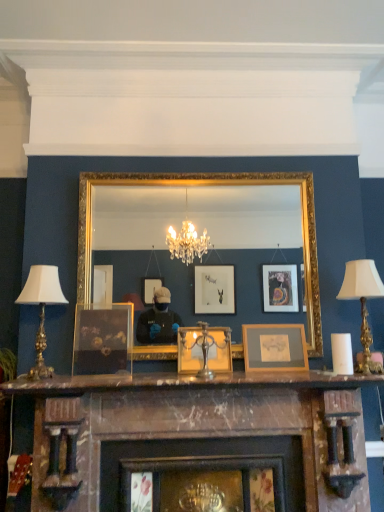
Describe the element at coordinates (199, 440) in the screenshot. I see `marble fireplace at center` at that location.

Identify the location of gold-framed mirror at center. (209, 185).

Where is `wooden picture frame at center, positioned as the first picture frame in right-to-left order`? wooden picture frame at center, positioned as the first picture frame in right-to-left order is located at coordinates (275, 347).

Locate an element on the screen. silver metallic table lamp at left, the 1th table lamp positioned from the left is located at coordinates (41, 309).

The width and height of the screenshot is (384, 512). I want to click on white fabric lampshade at right, the 1th table lamp from the right, so click(362, 296).

Based on their sizes in the image, would you say marble mantel at center is bigger or smaller than marble fireplace at center?

Considering their sizes, marble mantel at center takes up less space than marble fireplace at center.

From the image's perspective, which one is positioned lower, marble mantel at center or marble fireplace at center?

marble fireplace at center.

From a real-world perspective, relative to marble fireplace at center, is marble mantel at center vertically above or below?

Clearly, from a real-world perspective, marble mantel at center is above marble fireplace at center.

Considering the relative sizes of marble mantel at center and marble fireplace at center in the image provided, is marble mantel at center taller than marble fireplace at center?

No.

From the image's perspective, between marble mantel at center and matte glass picture frame at center, acting as the 3th picture frame starting from the right, who is located below?

From the image's view, marble mantel at center is below.

Is marble mantel at center thinner than matte glass picture frame at center, arranged as the first picture frame when viewed from the left?

Incorrect, the width of marble mantel at center is not less than that of matte glass picture frame at center, arranged as the first picture frame when viewed from the left.

Is marble mantel at center to the left of matte glass picture frame at center, acting as the 3th picture frame starting from the right, from the viewer's perspective?

No, marble mantel at center is not to the left of matte glass picture frame at center, acting as the 3th picture frame starting from the right.

Between marble mantel at center and matte glass picture frame at center, arranged as the first picture frame when viewed from the left, which one has smaller size?

With smaller size is matte glass picture frame at center, arranged as the first picture frame when viewed from the left.

Considering the relative sizes of silver metallic table lamp at left, the 2th table lamp when ordered from right to left, and gold-framed mirror at center in the image provided, is silver metallic table lamp at left, the 2th table lamp when ordered from right to left, smaller than gold-framed mirror at center?

Correct, silver metallic table lamp at left, the 2th table lamp when ordered from right to left, occupies less space than gold-framed mirror at center.

From the image's perspective, is silver metallic table lamp at left, the 2th table lamp when ordered from right to left, below gold-framed mirror at center?

Correct, silver metallic table lamp at left, the 2th table lamp when ordered from right to left, appears lower than gold-framed mirror at center in the image.

Who is shorter, silver metallic table lamp at left, the 1th table lamp positioned from the left, or gold-framed mirror at center?

silver metallic table lamp at left, the 1th table lamp positioned from the left.

Where is `the 2nd table lamp positioned below the gold-framed mirror at center (from a real-world perspective)`? the 2nd table lamp positioned below the gold-framed mirror at center (from a real-world perspective) is located at coordinates (41, 309).

Which is less distant, (305,249) or (288,351)?

Positioned in front is point (288,351).

Which of these two, gold-framed mirror at center or wooden picture frame at center, positioned as the first picture frame in right-to-left order, is smaller?

wooden picture frame at center, positioned as the first picture frame in right-to-left order.

Is gold-framed mirror at center next to wooden picture frame at center, positioned as the third picture frame in left-to-right order, and touching it?

There is a gap between gold-framed mirror at center and wooden picture frame at center, positioned as the third picture frame in left-to-right order.

How much distance is there between gold-framed mirror at center and wooden picture frame at center, positioned as the first picture frame in right-to-left order?

gold-framed mirror at center and wooden picture frame at center, positioned as the first picture frame in right-to-left order, are 30.98 centimeters apart.

Is point (376, 283) farther from viewer compared to point (282, 494)?

No, it is not.

From the image's perspective, starting from the marble fireplace at center, which table lamp is the 2nd one above? Please provide its 2D coordinates.

[(362, 296)]

Between white fabric lampshade at right, the 1th table lamp from the right, and marble fireplace at center, which one has smaller width?

white fabric lampshade at right, the 1th table lamp from the right, is thinner.

From a real-world perspective, which is physically above, marble mantel at center or silver metallic table lamp at left, the 2th table lamp when ordered from right to left?

From a 3D spatial view, silver metallic table lamp at left, the 2th table lamp when ordered from right to left, is above.

Is point (263, 372) in front of point (41, 300)?

No, it is not.

Is marble mantel at center further to camera compared to silver metallic table lamp at left, the 2th table lamp when ordered from right to left?

No, marble mantel at center is closer to the viewer.

From the image's perspective, which is below, marble mantel at center or silver metallic table lamp at left, the 1th table lamp positioned from the left?

marble mantel at center, from the image's perspective.

Is gold-framed mirror at center at the back of metallic gold picture frame at center, which is counted as the 2th picture frame, starting from the right?

Yes, gold-framed mirror at center is at the back of metallic gold picture frame at center, which is counted as the 2th picture frame, starting from the right.

The image size is (384, 512). I want to click on mirror behind the metallic gold picture frame at center, which is the second picture frame from left to right, so click(209, 185).

Can you confirm if metallic gold picture frame at center, which is the second picture frame from left to right, is smaller than gold-framed mirror at center?

Correct, metallic gold picture frame at center, which is the second picture frame from left to right, occupies less space than gold-framed mirror at center.

Image resolution: width=384 pixels, height=512 pixels. In order to click on fireplace on the left of marble mantel at center in this screenshot , I will do `click(199, 440)`.

Find the location of a particular element. mantle on the right of matte glass picture frame at center, acting as the 3th picture frame starting from the right is located at coordinates (187, 382).

Which object lies nearer to the anchor point metallic gold picture frame at center, which is the second picture frame from left to right, marble mantel at center or white fabric lampshade at right, the 1th table lamp from the right?

Based on the image, marble mantel at center appears to be nearer to metallic gold picture frame at center, which is the second picture frame from left to right.

In the scene shown: When comparing their distances from matte glass picture frame at center, arranged as the first picture frame when viewed from the left, does marble mantel at center or wooden picture frame at center, positioned as the third picture frame in left-to-right order, seem further?

Based on the image, wooden picture frame at center, positioned as the third picture frame in left-to-right order, appears to be further to matte glass picture frame at center, arranged as the first picture frame when viewed from the left.

From the image, which object appears to be nearer to metallic gold picture frame at center, which is the second picture frame from left to right, white fabric lampshade at right, the 1th table lamp from the right, or silver metallic table lamp at left, the 2th table lamp when ordered from right to left?

The object closer to metallic gold picture frame at center, which is the second picture frame from left to right, is white fabric lampshade at right, the 1th table lamp from the right.

From the image, which object appears to be farther from white fabric lampshade at right, acting as the 2th table lamp starting from the left, gold-framed mirror at center or marble mantel at center?

marble mantel at center lies further to white fabric lampshade at right, acting as the 2th table lamp starting from the left, than the other object.

Looking at the image, which one is located closer to silver metallic table lamp at left, the 1th table lamp positioned from the left, matte glass picture frame at center, arranged as the first picture frame when viewed from the left, or wooden picture frame at center, positioned as the first picture frame in right-to-left order?

matte glass picture frame at center, arranged as the first picture frame when viewed from the left, is positioned closer to the anchor silver metallic table lamp at left, the 1th table lamp positioned from the left.

Which object lies nearer to the anchor point matte glass picture frame at center, arranged as the first picture frame when viewed from the left, metallic gold picture frame at center, which is counted as the 2th picture frame, starting from the right, or white fabric lampshade at right, acting as the 2th table lamp starting from the left?

Among the two, metallic gold picture frame at center, which is counted as the 2th picture frame, starting from the right, is located nearer to matte glass picture frame at center, arranged as the first picture frame when viewed from the left.

Looking at the image, which one is located closer to marble mantel at center, gold-framed mirror at center or metallic gold picture frame at center, which is the second picture frame from left to right?

metallic gold picture frame at center, which is the second picture frame from left to right, is closer to marble mantel at center.

Looking at the image, which one is located further to white fabric lampshade at right, acting as the 2th table lamp starting from the left, matte glass picture frame at center, acting as the 3th picture frame starting from the right, or metallic gold picture frame at center, which is the second picture frame from left to right?

matte glass picture frame at center, acting as the 3th picture frame starting from the right, is positioned further to the anchor white fabric lampshade at right, acting as the 2th table lamp starting from the left.

You are a GUI agent. You are given a task and a screenshot of the screen. Output one action in this format:
    pyautogui.click(x=<x>, y=<y>)
    Task: Click on the mantle between matte glass picture frame at center, acting as the 3th picture frame starting from the right, and wooden picture frame at center, positioned as the third picture frame in left-to-right order, in the horizontal direction
    This screenshot has height=512, width=384.
    Given the screenshot: What is the action you would take?
    pyautogui.click(x=187, y=382)

Where is `mirror between silver metallic table lamp at left, the 1th table lamp positioned from the left, and wooden picture frame at center, positioned as the third picture frame in left-to-right order`? The image size is (384, 512). mirror between silver metallic table lamp at left, the 1th table lamp positioned from the left, and wooden picture frame at center, positioned as the third picture frame in left-to-right order is located at coordinates (209, 185).

In order to click on picture frame between matte glass picture frame at center, acting as the 3th picture frame starting from the right, and wooden picture frame at center, positioned as the third picture frame in left-to-right order, in the horizontal direction in this screenshot , I will do `click(204, 350)`.

Where is `picture frame between silver metallic table lamp at left, the 1th table lamp positioned from the left, and metallic gold picture frame at center, which is the second picture frame from left to right, from left to right`? Image resolution: width=384 pixels, height=512 pixels. picture frame between silver metallic table lamp at left, the 1th table lamp positioned from the left, and metallic gold picture frame at center, which is the second picture frame from left to right, from left to right is located at coordinates pos(103,340).